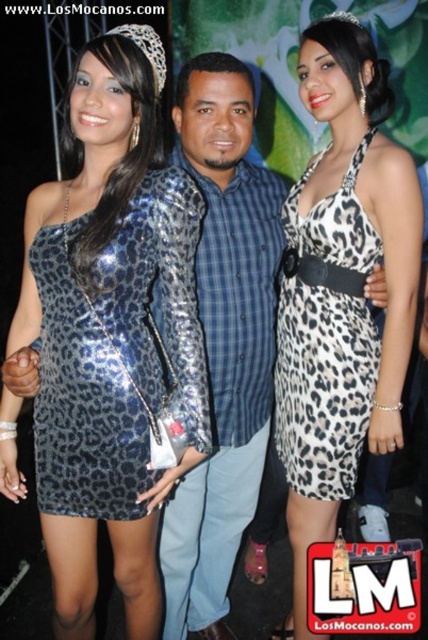
Is shiny metallic dress at center wider than leopard print dress at center?

Indeed, shiny metallic dress at center has a greater width compared to leopard print dress at center.

Is point (71, 550) closer to viewer compared to point (306, 33)?

That is True.

Does point (193, 202) come closer to viewer compared to point (353, 387)?

Yes, point (193, 202) is in front of point (353, 387).

Image resolution: width=428 pixels, height=640 pixels. What are the coordinates of `shiny metallic dress at center` in the screenshot? It's located at (107, 328).

Based on the photo, who is more forward, (x=109, y=500) or (x=246, y=262)?

Point (x=109, y=500) is more forward.

Does point (67, 481) lie behind point (244, 211)?

No, (67, 481) is closer to viewer.

Identify the location of shiny metallic dress at center. (107, 328).

Who is positioned more to the left, leopard print dress at center or leopard print fabric dress at center?

From the viewer's perspective, leopard print fabric dress at center appears more on the left side.

Does leopard print dress at center have a larger size compared to leopard print fabric dress at center?

Indeed, leopard print dress at center has a larger size compared to leopard print fabric dress at center.

Who is more distant from viewer, [332,513] or [350,332]?

Point [332,513]

Find the location of a particular element. leopard print dress at center is located at coordinates (341, 289).